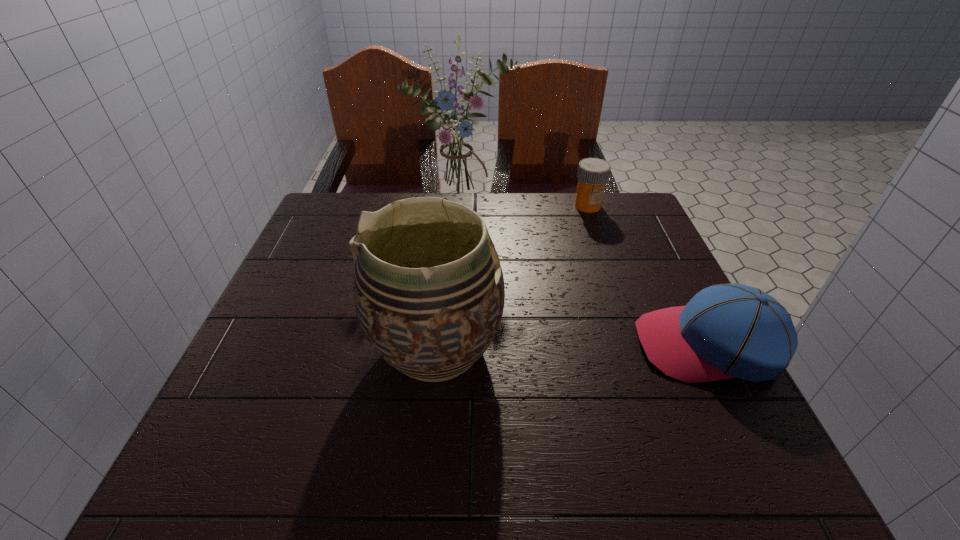
At what (x,y) coordinates should I click in order to perform the action: click on object that is at the far right corner. Please return your answer as a coordinate pair (x, y). Looking at the image, I should click on (593, 173).

I want to click on object present at the near right corner, so click(x=725, y=331).

What are the coordinates of `blank space at the far edge of the desktop` in the screenshot? It's located at (528, 210).

Image resolution: width=960 pixels, height=540 pixels. Find the location of `free space at the near edge of the desktop`. free space at the near edge of the desktop is located at coordinates (495, 391).

The width and height of the screenshot is (960, 540). In the image, there is a desktop. Find the location of `free space at the left edge`. free space at the left edge is located at coordinates (313, 378).

I want to click on vacant region at the right edge of the desktop, so click(x=623, y=267).

Where is `free space at the far left corner of the desktop`? This screenshot has width=960, height=540. free space at the far left corner of the desktop is located at coordinates (331, 204).

Locate an element on the screen. The width and height of the screenshot is (960, 540). vacant area at the far right corner is located at coordinates (599, 225).

Locate an element on the screen. Image resolution: width=960 pixels, height=540 pixels. free space between the baseball cap and the tallest object is located at coordinates (585, 277).

Identify the location of vacant space in between the medicine and the bouquet. The width and height of the screenshot is (960, 540). (524, 208).